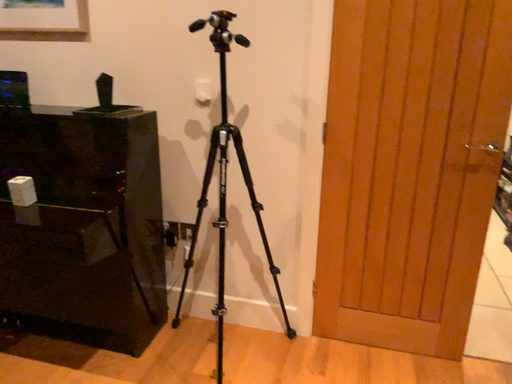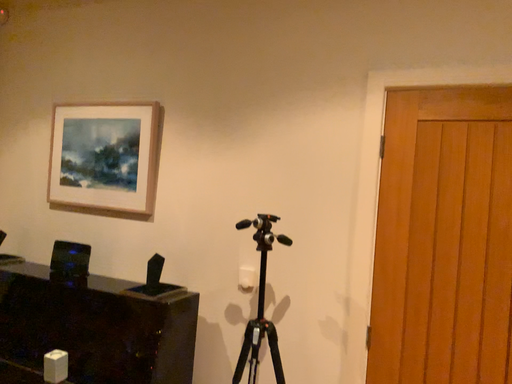
Question: How did the camera likely rotate when shooting the video?

Choices:
 (A) rotated left
 (B) rotated right

Answer: (A)